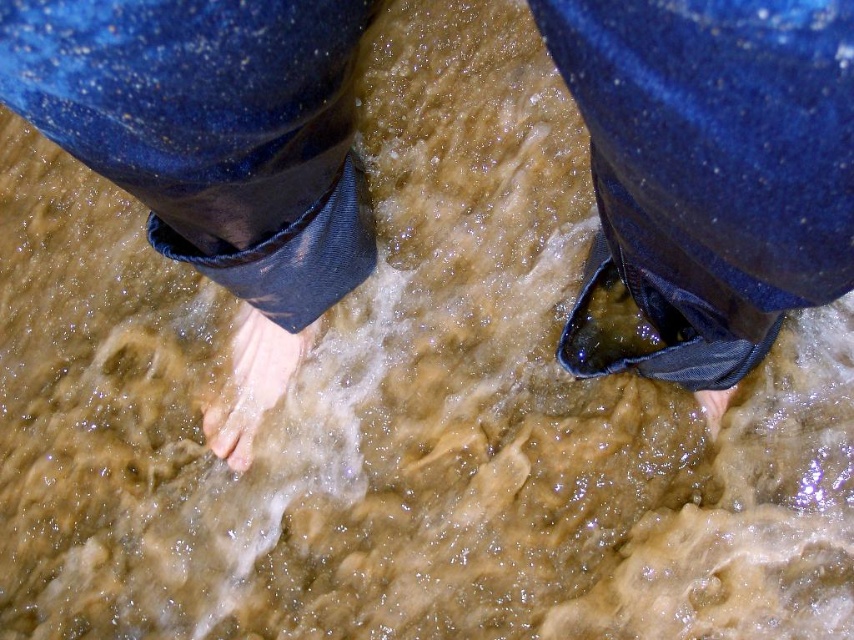
You are a drone operator trying to capture a photo of the denim at lower right and the matte skin toe at lower center. The minimum distance required between the two objects for the drone to focus on both clearly is 16 inches. Based on the scene, will the drone be able to capture both objects in focus?

The denim at lower right and the matte skin toe at lower center are 15.71 inches apart, which is less than the required 16 inches. Therefore, the drone may not be able to focus on both clearly.

You are trying to find your left toe in the water. You see denim at lower right and matte skin toe at lower center. Which object is closer to your left side?

The denim at lower right is to the left of matte skin toe at lower center, so the denim at lower right is closer to your left side.